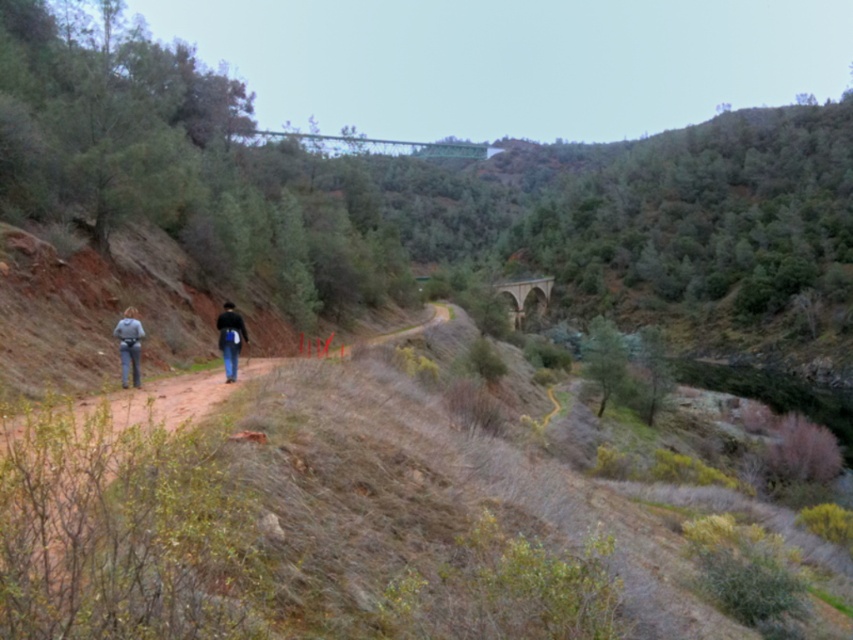
Question: Which object appears farthest from the camera in this image?

Choices:
 (A) dark gray jeans at left
 (B) dark blue jacket at center

Answer: (B)

Question: Which of the following is the farthest from the observer?

Choices:
 (A) (134, 384)
 (B) (138, 333)

Answer: (A)

Question: Which object is positioned closest to the denim pants at left?

Choices:
 (A) dark gray jeans at left
 (B) dark blue jacket at center

Answer: (A)

Question: Is denim pants at left wider than dark blue jacket at center?

Choices:
 (A) yes
 (B) no

Answer: (A)

Question: Does dark gray jeans at left have a lesser width compared to dark blue jacket at center?

Choices:
 (A) yes
 (B) no

Answer: (B)

Question: Does dark gray jeans at left appear on the right side of denim pants at left?

Choices:
 (A) yes
 (B) no

Answer: (A)